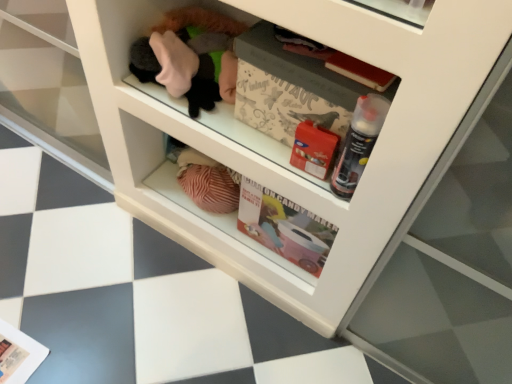
Question: Is matte paper magazine at lower left, the first magazine positioned from the back, in front of or behind translucent plastic spray can at center right in the image?

Choices:
 (A) front
 (B) behind

Answer: (B)

Question: Is point (32, 347) closer or farther from the camera than point (354, 180)?

Choices:
 (A) farther
 (B) closer

Answer: (A)

Question: Based on their relative distances, which object is farther from the translucent plastic spray can at center right?

Choices:
 (A) matte paper magazine at lower left, which ranks as the first magazine in left-to-right order
 (B) white paper magazine at center, the first magazine from the front

Answer: (A)

Question: Which is farther from the matte paper magazine at lower left, placed as the 1th magazine when sorted from bottom to top?

Choices:
 (A) white paper magazine at center, placed as the 1th magazine when sorted from top to bottom
 (B) translucent plastic spray can at center right

Answer: (B)